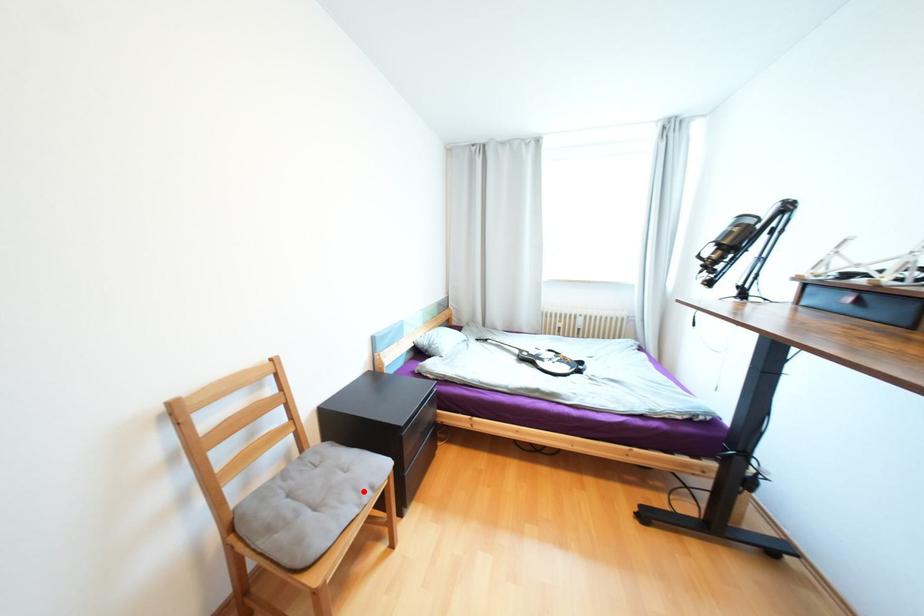
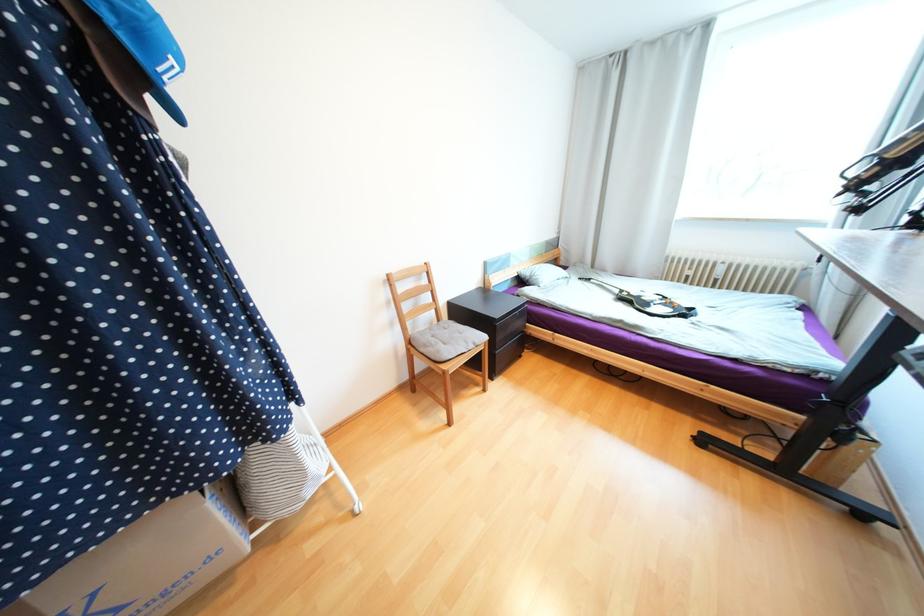
Locate, in the second image, the point that corresponds to the highlighted location in the first image.

(472, 342)